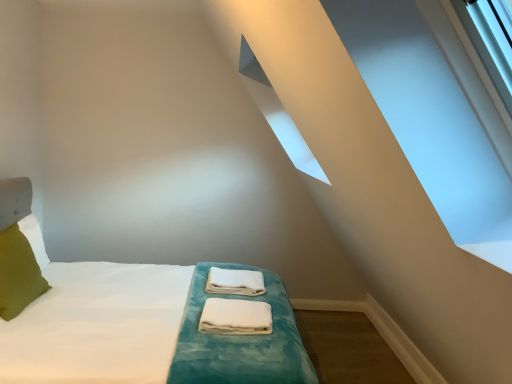
Question: From the image's perspective, is white fabric towels at center, which ranks as the 1th material in back-to-front order, below white cotton towels at center, marked as the first material in a front-to-back arrangement?

Choices:
 (A) no
 (B) yes

Answer: (A)

Question: Can you confirm if white fabric towels at center, marked as the 2th material in a front-to-back arrangement, is shorter than white cotton towels at center, marked as the first material in a front-to-back arrangement?

Choices:
 (A) no
 (B) yes

Answer: (A)

Question: Is white cotton towels at center, which is the second material from back to front, completely or partially inside white fabric towels at center, marked as the 2th material in a front-to-back arrangement?

Choices:
 (A) no
 (B) yes

Answer: (A)

Question: Considering the relative sizes of white fabric towels at center, which ranks as the 1th material in back-to-front order, and white cotton towels at center, which is the second material from back to front, in the image provided, is white fabric towels at center, which ranks as the 1th material in back-to-front order, taller than white cotton towels at center, which is the second material from back to front,?

Choices:
 (A) no
 (B) yes

Answer: (B)

Question: Is white cotton towels at center, marked as the first material in a front-to-back arrangement, at the back of white fabric towels at center, which ranks as the 1th material in back-to-front order?

Choices:
 (A) no
 (B) yes

Answer: (A)

Question: Is white fabric towels at center, which ranks as the 1th material in back-to-front order, thinner than white cotton towels at center, marked as the first material in a front-to-back arrangement?

Choices:
 (A) yes
 (B) no

Answer: (B)

Question: From the image's perspective, is green fabric pillow at left located beneath white soft bed at center?

Choices:
 (A) yes
 (B) no

Answer: (B)

Question: From a real-world perspective, is green fabric pillow at left below white soft bed at center?

Choices:
 (A) no
 (B) yes

Answer: (A)

Question: From the image's perspective, is green fabric pillow at left on white soft bed at center?

Choices:
 (A) no
 (B) yes

Answer: (B)

Question: Is white soft bed at center inside green fabric pillow at left?

Choices:
 (A) yes
 (B) no

Answer: (B)

Question: Can you confirm if green fabric pillow at left is wider than white soft bed at center?

Choices:
 (A) yes
 (B) no

Answer: (B)

Question: Is green fabric pillow at left at the left side of white soft bed at center?

Choices:
 (A) no
 (B) yes

Answer: (B)

Question: Is green fabric pillow at left further to camera compared to white cotton towels at center, marked as the first material in a front-to-back arrangement?

Choices:
 (A) yes
 (B) no

Answer: (B)